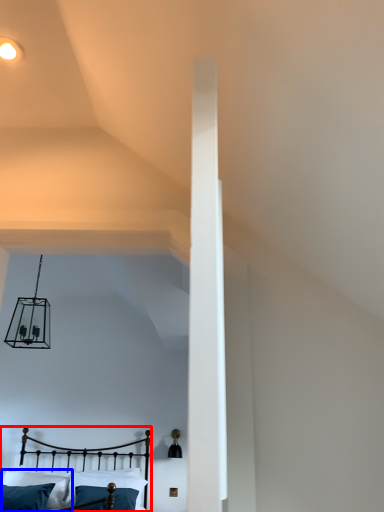
Question: Among these objects, which one is nearest to the camera, bed (highlighted by a red box) or pillow (highlighted by a blue box)?

Choices:
 (A) bed
 (B) pillow

Answer: (A)